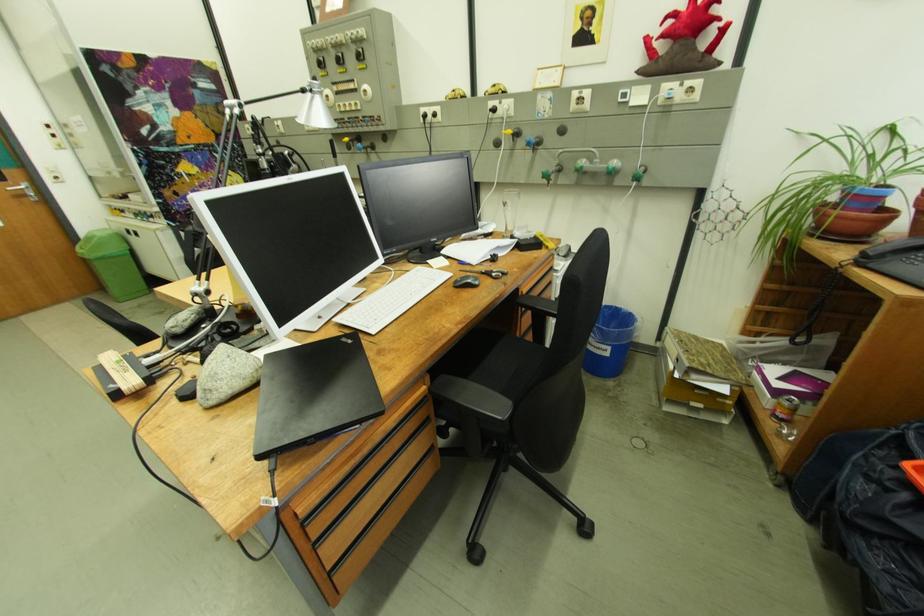
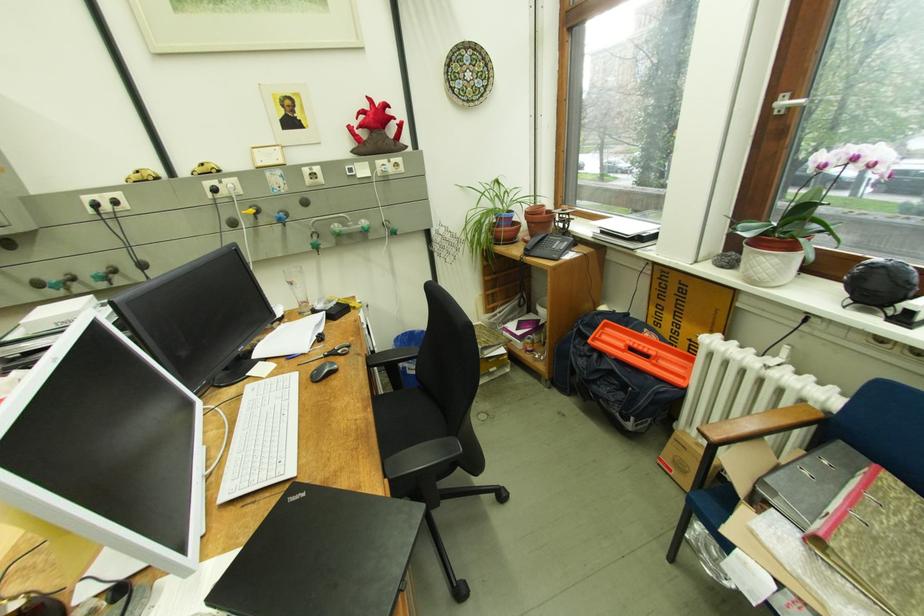
Find the pixel in the second image that matches (515,205) in the first image.

(301, 284)